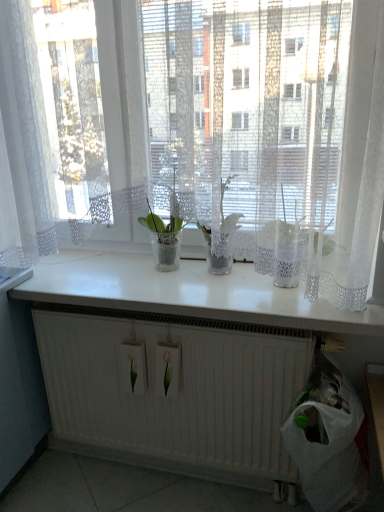
Question: Is white glossy counter top at center not close to white lace curtain at upper center?

Choices:
 (A) no
 (B) yes

Answer: (A)

Question: From a real-world perspective, is white glossy counter top at center positioned under white lace curtain at upper center based on gravity?

Choices:
 (A) no
 (B) yes

Answer: (B)

Question: From a real-world perspective, is white glossy counter top at center positioned over white lace curtain at upper center based on gravity?

Choices:
 (A) yes
 (B) no

Answer: (B)

Question: Is white glossy counter top at center thinner than white lace curtain at upper center?

Choices:
 (A) no
 (B) yes

Answer: (A)

Question: Does white glossy counter top at center have a smaller size compared to white lace curtain at upper center?

Choices:
 (A) yes
 (B) no

Answer: (A)

Question: Does white glossy counter top at center appear on the right side of white lace curtain at upper center?

Choices:
 (A) no
 (B) yes

Answer: (B)

Question: Is the position of translucent glass vase at center less distant than that of translucent glass vase at center?

Choices:
 (A) yes
 (B) no

Answer: (A)

Question: Considering the relative positions of translucent glass vase at center and translucent glass vase at center in the image provided, is translucent glass vase at center to the right of translucent glass vase at center from the viewer's perspective?

Choices:
 (A) yes
 (B) no

Answer: (A)

Question: From the image's perspective, does translucent glass vase at center appear lower than translucent glass vase at center?

Choices:
 (A) no
 (B) yes

Answer: (A)

Question: Is translucent glass vase at center far away from translucent glass vase at center?

Choices:
 (A) no
 (B) yes

Answer: (A)

Question: Does translucent glass vase at center have a larger size compared to translucent glass vase at center?

Choices:
 (A) no
 (B) yes

Answer: (A)

Question: Is translucent glass vase at center smaller than translucent glass vase at center?

Choices:
 (A) no
 (B) yes

Answer: (B)

Question: Is white glossy counter top at center bigger than white matte radiator at lower center?

Choices:
 (A) no
 (B) yes

Answer: (B)